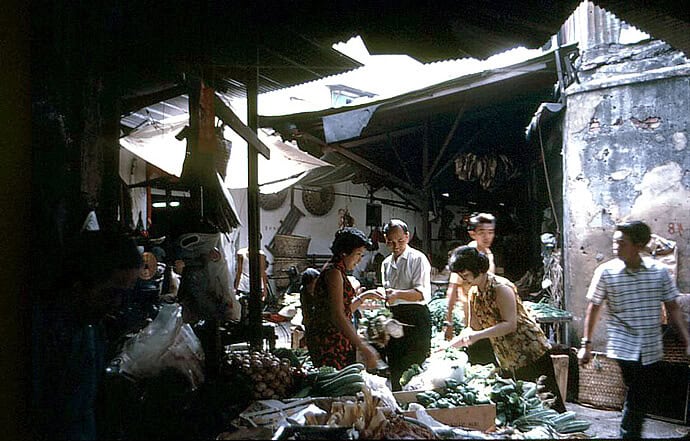
This screenshot has height=441, width=690. I want to click on white wall, so click(x=315, y=233).